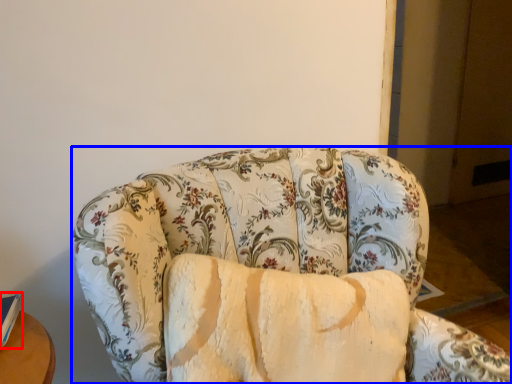
Question: Which point is further to the camera, book (highlighted by a red box) or studio couch (highlighted by a blue box)?

Choices:
 (A) book
 (B) studio couch

Answer: (A)